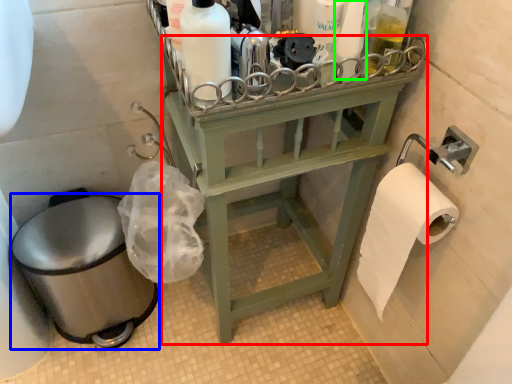
Question: Which is nearer to the furniture (highlighted by a red box)? toilet bowl (highlighted by a blue box) or toiletry (highlighted by a green box).

Choices:
 (A) toilet bowl
 (B) toiletry

Answer: (A)